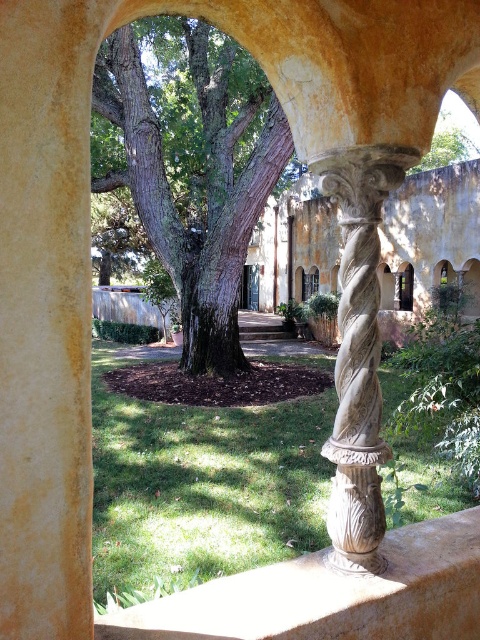
Is smooth stone ledge at center bigger than green leafy tree at upper center?

Incorrect, smooth stone ledge at center is not larger than green leafy tree at upper center.

Which is in front, point (375, 595) or point (467, 157)?

Point (375, 595)

Locate an element on the screen. This screenshot has height=640, width=480. smooth stone ledge at center is located at coordinates (331, 595).

Between point (307, 577) and point (369, 548), which one is positioned in front?

Point (369, 548) is more forward.

Who is positioned more to the left, smooth stone ledge at center or carved stone column at center?

smooth stone ledge at center

The width and height of the screenshot is (480, 640). I want to click on smooth stone ledge at center, so click(x=331, y=595).

Which is in front, point (358, 330) or point (454, 131)?

Positioned in front is point (358, 330).

Which of these two, carved stone column at center or green leafy tree at upper center, stands shorter?

carved stone column at center

Where is `carved stone column at center`? The height and width of the screenshot is (640, 480). carved stone column at center is located at coordinates (359, 353).